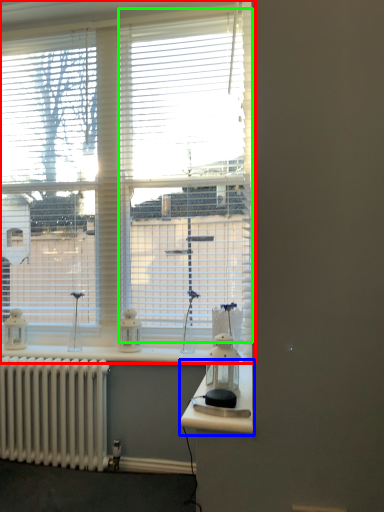
Question: Which object is positioned farthest from window (highlighted by a red box)? Select from table (highlighted by a blue box) and window (highlighted by a green box).

Choices:
 (A) table
 (B) window

Answer: (A)